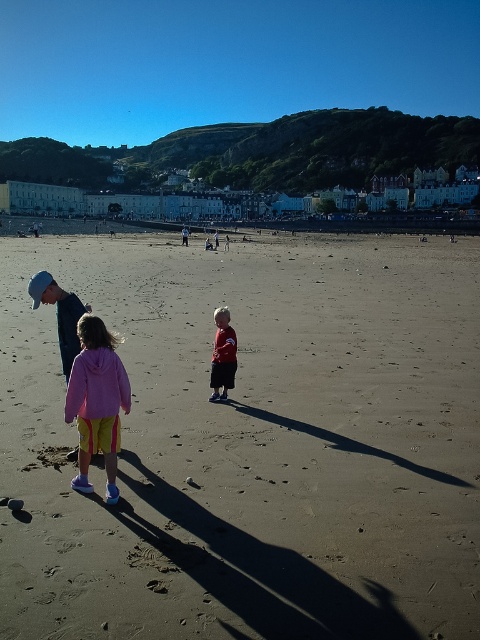
Question: Is brown sandy beach at center to the left of matte red shirt at center from the viewer's perspective?

Choices:
 (A) yes
 (B) no

Answer: (B)

Question: Does brown sandy beach at center have a larger size compared to pink fleece jacket at center?

Choices:
 (A) yes
 (B) no

Answer: (A)

Question: Is pink fleece jacket at center to the right of matte red shirt at center from the viewer's perspective?

Choices:
 (A) yes
 (B) no

Answer: (B)

Question: Which object appears farthest from the camera in this image?

Choices:
 (A) brown sandy beach at center
 (B) pink fleece jacket at center
 (C) matte red shirt at center

Answer: (C)

Question: Which object is closer to the camera taking this photo?

Choices:
 (A) matte red shirt at center
 (B) brown sandy beach at center
 (C) pink fleece jacket at center

Answer: (B)

Question: Which of the following is the farthest from the observer?

Choices:
 (A) brown sandy beach at center
 (B) matte red shirt at center
 (C) pink fleece jacket at center

Answer: (B)